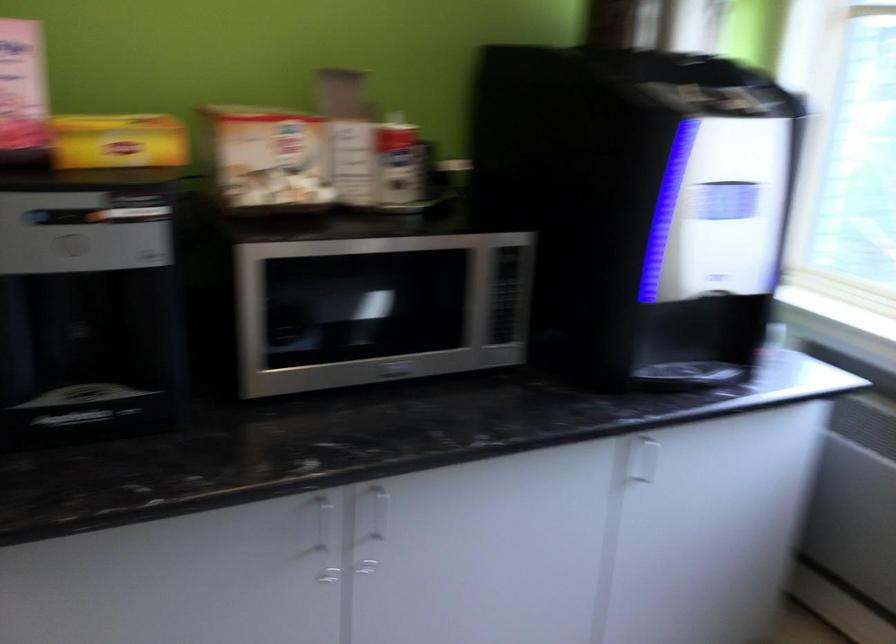
First-person continuous shooting, in which direction is the camera rotating?

The camera's rotation is toward left-down.